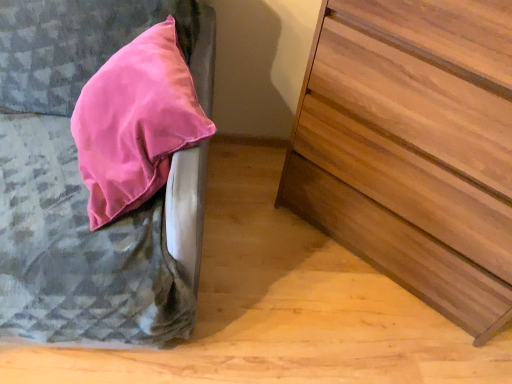
Question: Can you confirm if wooden chest of drawers at right is taller than satin pink pillow at upper left?

Choices:
 (A) yes
 (B) no

Answer: (A)

Question: Considering the relative sizes of wooden chest of drawers at right and satin pink pillow at upper left in the image provided, is wooden chest of drawers at right smaller than satin pink pillow at upper left?

Choices:
 (A) yes
 (B) no

Answer: (A)

Question: Is wooden chest of drawers at right looking in the opposite direction of satin pink pillow at upper left?

Choices:
 (A) no
 (B) yes

Answer: (A)

Question: Does wooden chest of drawers at right appear on the left side of satin pink pillow at upper left?

Choices:
 (A) no
 (B) yes

Answer: (A)

Question: Is wooden chest of drawers at right in front of satin pink pillow at upper left?

Choices:
 (A) yes
 (B) no

Answer: (B)

Question: From the image's perspective, is wooden chest of drawers at right under satin pink pillow at upper left?

Choices:
 (A) yes
 (B) no

Answer: (A)

Question: Can you confirm if satin pink pillow at upper left is bigger than wooden chest of drawers at right?

Choices:
 (A) no
 (B) yes

Answer: (B)

Question: Is satin pink pillow at upper left completely or partially outside of wooden chest of drawers at right?

Choices:
 (A) yes
 (B) no

Answer: (A)

Question: Is satin pink pillow at upper left closer to camera compared to wooden chest of drawers at right?

Choices:
 (A) no
 (B) yes

Answer: (B)

Question: From a real-world perspective, is satin pink pillow at upper left on top of wooden chest of drawers at right?

Choices:
 (A) yes
 (B) no

Answer: (B)

Question: Is satin pink pillow at upper left looking in the opposite direction of wooden chest of drawers at right?

Choices:
 (A) no
 (B) yes

Answer: (A)

Question: From a real-world perspective, is satin pink pillow at upper left positioned under wooden chest of drawers at right based on gravity?

Choices:
 (A) no
 (B) yes

Answer: (B)

Question: Looking at their shapes, would you say satin pink pillow at upper left is wider or thinner than wooden chest of drawers at right?

Choices:
 (A) wide
 (B) thin

Answer: (A)